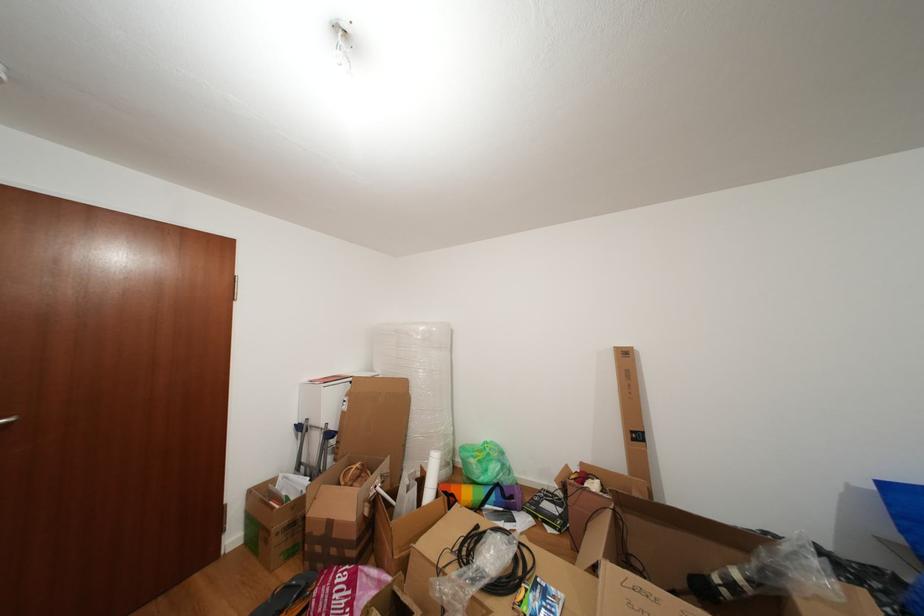
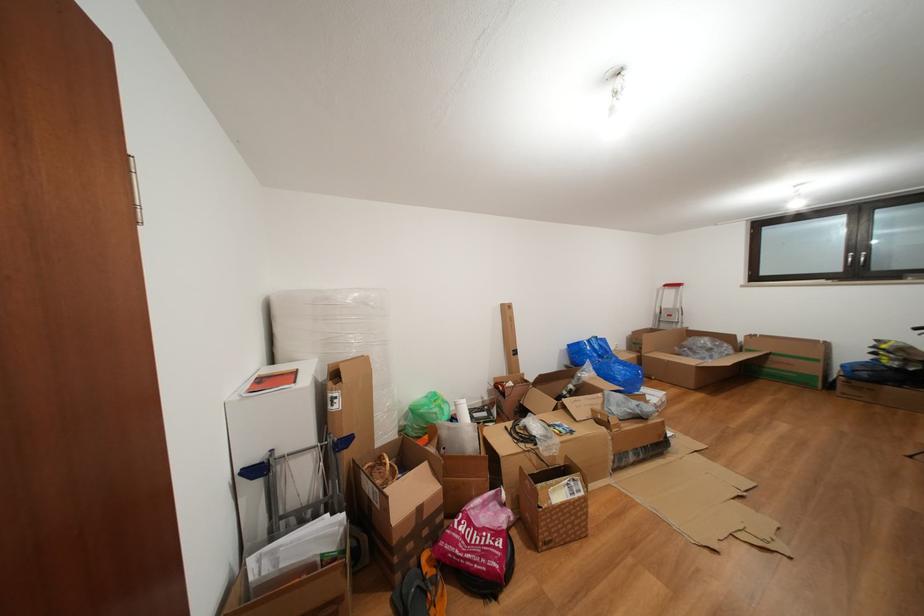
The point at (373, 573) is marked in the first image. Where is the corresponding point in the second image?

(480, 511)